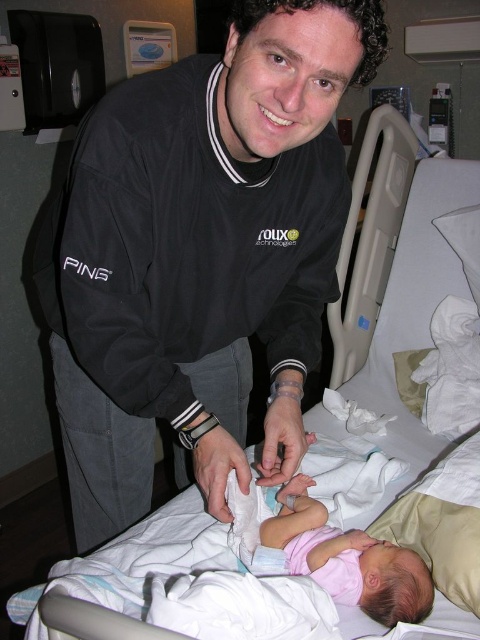
Is point (245, 44) less distant than point (300, 532)?

Yes, it is in front of point (300, 532).

This screenshot has width=480, height=640. What do you see at coordinates (200, 256) in the screenshot? I see `black soft jacket at center` at bounding box center [200, 256].

Locate an element on the screen. Image resolution: width=480 pixels, height=640 pixels. black soft jacket at center is located at coordinates (200, 256).